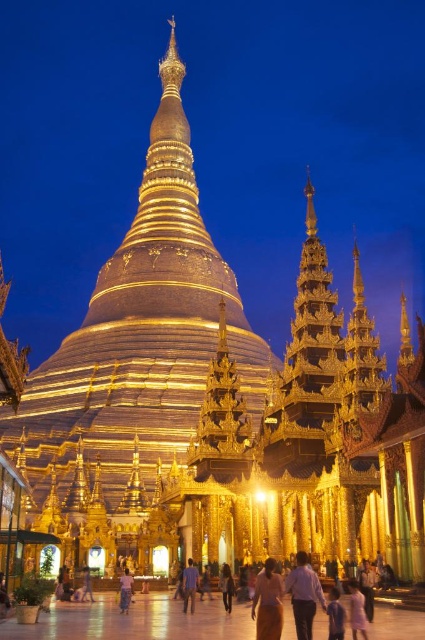
Question: Which object is the farthest from the pink fabric dress at lower center?

Choices:
 (A) light brown fabric dress at center
 (B) purple satin dress at lower right
 (C) purple cotton shirt at center
 (D) purple shirt at center

Answer: (C)

Question: Where is pink fabric dress at lower center located in relation to purple cotton shirt at center in the image?

Choices:
 (A) above
 (B) below

Answer: (A)

Question: Can you confirm if light brown fabric dress at center is bigger than light brown fabric skirt at center?

Choices:
 (A) no
 (B) yes

Answer: (A)

Question: Which point is closer to the camera?

Choices:
 (A) purple cotton shirt at center
 (B) light brown fabric skirt at center

Answer: (B)

Question: Which of the following is the farthest from the observer?

Choices:
 (A) pink fabric dress at lower center
 (B) matte gold dress at center
 (C) light brown fabric dress at center

Answer: (C)

Question: In this image, where is purple satin dress at lower right located relative to pink fabric dress at lower center?

Choices:
 (A) above
 (B) below

Answer: (A)